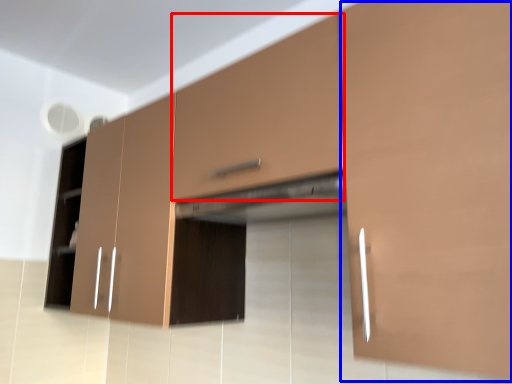
Question: Which object is further to the camera taking this photo, drawer (highlighted by a red box) or cabinetry (highlighted by a blue box)?

Choices:
 (A) drawer
 (B) cabinetry

Answer: (A)